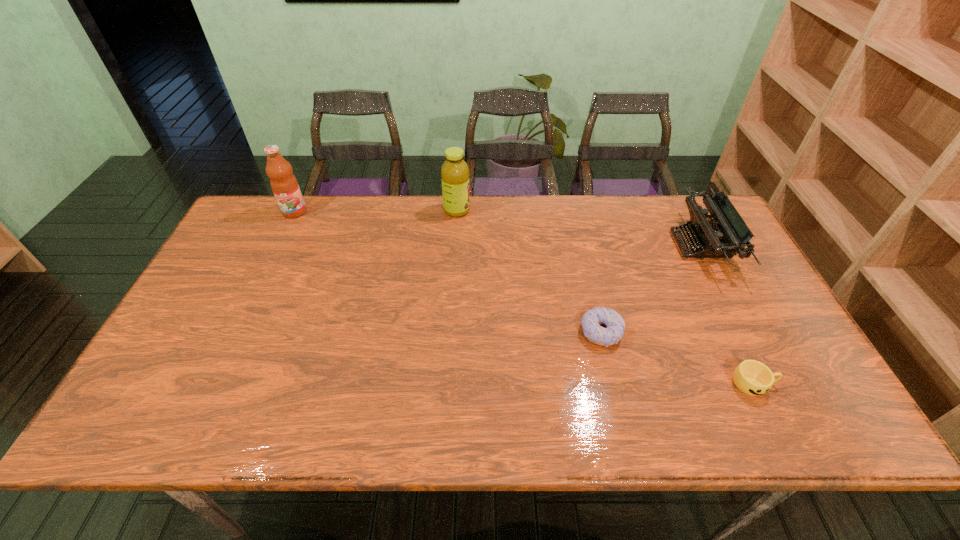
I want to click on object that is positioned at the near right corner, so click(x=752, y=377).

Find the location of a particular element. The image size is (960, 540). free space at the far edge of the desktop is located at coordinates (627, 225).

Where is `vacant area at the near edge of the desktop`? vacant area at the near edge of the desktop is located at coordinates (604, 431).

You are a GUI agent. You are given a task and a screenshot of the screen. Output one action in this format:
    pyautogui.click(x=<x>, y=<y>)
    Task: Click on the free space at the left edge of the desktop
    
    Given the screenshot: What is the action you would take?
    pyautogui.click(x=256, y=250)

In the image, there is a desktop. In order to click on free space at the right edge in this screenshot , I will do tap(769, 327).

Find the location of a particular element. This screenshot has width=960, height=540. vacant space at the far right corner of the desktop is located at coordinates tap(665, 201).

Locate an element on the screen. The width and height of the screenshot is (960, 540). vacant point located between the leftmost object and the cup is located at coordinates (524, 298).

At what (x,y) coordinates should I click in order to perform the action: click on free spot between the left fruit juice and the right fruit juice. Please return your answer as a coordinate pair (x, y). The width and height of the screenshot is (960, 540). Looking at the image, I should click on (375, 211).

I want to click on vacant region between the leftmost object and the typewriter, so click(x=497, y=228).

Where is `free space between the nearest object and the leftmost object`? Image resolution: width=960 pixels, height=540 pixels. free space between the nearest object and the leftmost object is located at coordinates (524, 298).